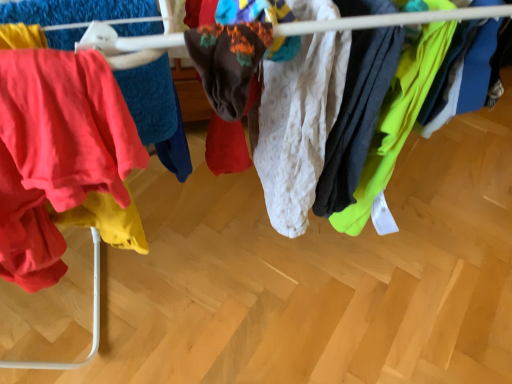
Measure the distance between white textured fabric at center, which appears as the 1th clothing when viewed from the left, and camera.

The depth of white textured fabric at center, which appears as the 1th clothing when viewed from the left, is 14.96 inches.

What do you see at coordinates (298, 126) in the screenshot? This screenshot has width=512, height=384. I see `white textured fabric at center, which appears as the 1th clothing when viewed from the left` at bounding box center [298, 126].

What are the coordinates of `white textured fabric at center, which appears as the 1th clothing when viewed from the left` in the screenshot? It's located at (298, 126).

The width and height of the screenshot is (512, 384). What do you see at coordinates (396, 120) in the screenshot?
I see `white textured fabric at center, positioned as the 1th clothing in right-to-left order` at bounding box center [396, 120].

You are a GUI agent. You are given a task and a screenshot of the screen. Output one action in this format:
    pyautogui.click(x=<x>, y=<y>)
    Task: Click on the white textured fabric at center, positioned as the 1th clothing in right-to-left order
    Image resolution: width=512 pixels, height=384 pixels.
    Given the screenshot: What is the action you would take?
    pyautogui.click(x=396, y=120)

Identify the location of white textured fabric at center, which appears as the second clothing when viewed from the right. (298, 126).

Which object is positioned more to the right, white textured fabric at center, which appears as the 1th clothing when viewed from the left, or white textured fabric at center, positioned as the 1th clothing in right-to-left order?

white textured fabric at center, positioned as the 1th clothing in right-to-left order.

Looking at this image, considering the positions of objects white textured fabric at center, which appears as the 1th clothing when viewed from the left, and white textured fabric at center, positioned as the 1th clothing in right-to-left order, in the image provided, who is behind, white textured fabric at center, which appears as the 1th clothing when viewed from the left, or white textured fabric at center, positioned as the 1th clothing in right-to-left order,?

white textured fabric at center, positioned as the 1th clothing in right-to-left order, is more distant.

Considering the points (266, 181) and (395, 159), which point is behind, point (266, 181) or point (395, 159)?

The point (266, 181) is farther.

From the image's perspective, does white textured fabric at center, which appears as the 1th clothing when viewed from the left, appear lower than white textured fabric at center, the second clothing from the left?

Actually, white textured fabric at center, which appears as the 1th clothing when viewed from the left, appears above white textured fabric at center, the second clothing from the left, in the image.

From a real-world perspective, between white textured fabric at center, which appears as the second clothing when viewed from the right, and white textured fabric at center, positioned as the 1th clothing in right-to-left order, who is vertically higher?

In real-world perspective, white textured fabric at center, positioned as the 1th clothing in right-to-left order, is above.

Considering the relative sizes of white textured fabric at center, which appears as the 1th clothing when viewed from the left, and white textured fabric at center, positioned as the 1th clothing in right-to-left order, in the image provided, is white textured fabric at center, which appears as the 1th clothing when viewed from the left, wider than white textured fabric at center, positioned as the 1th clothing in right-to-left order,?

In fact, white textured fabric at center, which appears as the 1th clothing when viewed from the left, might be narrower than white textured fabric at center, positioned as the 1th clothing in right-to-left order.

From the picture: Is white textured fabric at center, which appears as the second clothing when viewed from the right, taller or shorter than white textured fabric at center, positioned as the 1th clothing in right-to-left order?

In the image, white textured fabric at center, which appears as the second clothing when viewed from the right, appears to be taller than white textured fabric at center, positioned as the 1th clothing in right-to-left order.

Considering the relative sizes of white textured fabric at center, which appears as the second clothing when viewed from the right, and white textured fabric at center, the second clothing from the left, in the image provided, is white textured fabric at center, which appears as the second clothing when viewed from the right, bigger than white textured fabric at center, the second clothing from the left,?

Indeed, white textured fabric at center, which appears as the second clothing when viewed from the right, has a larger size compared to white textured fabric at center, the second clothing from the left.

Is white textured fabric at center, which appears as the 1th clothing when viewed from the left, inside the boundaries of white textured fabric at center, the second clothing from the left, or outside?

white textured fabric at center, which appears as the 1th clothing when viewed from the left, is outside white textured fabric at center, the second clothing from the left.

Is white textured fabric at center, which appears as the 1th clothing when viewed from the left, next to white textured fabric at center, the second clothing from the left?

No.

Looking at this image, is white textured fabric at center, which appears as the second clothing when viewed from the right, oriented towards white textured fabric at center, the second clothing from the left?

Yes, white textured fabric at center, which appears as the second clothing when viewed from the right, is turned towards white textured fabric at center, the second clothing from the left.

How different are the orientations of white textured fabric at center, which appears as the 1th clothing when viewed from the left, and white textured fabric at center, positioned as the 1th clothing in right-to-left order, in degrees?

0.00608 degrees separate the facing orientations of white textured fabric at center, which appears as the 1th clothing when viewed from the left, and white textured fabric at center, positioned as the 1th clothing in right-to-left order.

At what (x,y) coordinates should I click in order to perform the action: click on clothing beneath the white textured fabric at center, the second clothing from the left (from a real-world perspective). Please return your answer as a coordinate pair (x, y). The image size is (512, 384). Looking at the image, I should click on (298, 126).

Between white textured fabric at center, the second clothing from the left, and white textured fabric at center, which appears as the 1th clothing when viewed from the left, which one appears on the right side from the viewer's perspective?

white textured fabric at center, the second clothing from the left, is more to the right.

Which is behind, white textured fabric at center, positioned as the 1th clothing in right-to-left order, or white textured fabric at center, which appears as the second clothing when viewed from the right?

white textured fabric at center, positioned as the 1th clothing in right-to-left order, is further from the camera.

Does point (358, 202) appear closer or farther from the camera than point (328, 39)?

Point (358, 202) is positioned farther from the camera compared to point (328, 39).

From the image's perspective, does white textured fabric at center, the second clothing from the left, appear higher than white textured fabric at center, which appears as the second clothing when viewed from the right?

No, from the image's perspective, white textured fabric at center, the second clothing from the left, is not on top of white textured fabric at center, which appears as the second clothing when viewed from the right.

Looking at this image, from a real-world perspective, which object rests below the other?

In real-world perspective, white textured fabric at center, which appears as the 1th clothing when viewed from the left, is lower.

Based on the photo, considering the sizes of objects white textured fabric at center, the second clothing from the left, and white textured fabric at center, which appears as the 1th clothing when viewed from the left, in the image provided, who is wider, white textured fabric at center, the second clothing from the left, or white textured fabric at center, which appears as the 1th clothing when viewed from the left,?

Wider between the two is white textured fabric at center, the second clothing from the left.

In the scene shown: Can you confirm if white textured fabric at center, positioned as the 1th clothing in right-to-left order, is shorter than white textured fabric at center, which appears as the 1th clothing when viewed from the left?

Correct, white textured fabric at center, positioned as the 1th clothing in right-to-left order, is not as tall as white textured fabric at center, which appears as the 1th clothing when viewed from the left.

Looking at the image, does white textured fabric at center, positioned as the 1th clothing in right-to-left order, seem bigger or smaller compared to white textured fabric at center, which appears as the 1th clothing when viewed from the left?

white textured fabric at center, positioned as the 1th clothing in right-to-left order, is smaller than white textured fabric at center, which appears as the 1th clothing when viewed from the left.

Is white textured fabric at center, the second clothing from the left, inside the boundaries of white textured fabric at center, which appears as the 1th clothing when viewed from the left, or outside?

white textured fabric at center, the second clothing from the left, exists outside the volume of white textured fabric at center, which appears as the 1th clothing when viewed from the left.

Consider the image. Are white textured fabric at center, positioned as the 1th clothing in right-to-left order, and white textured fabric at center, which appears as the second clothing when viewed from the right, located far from each other?

No, white textured fabric at center, positioned as the 1th clothing in right-to-left order, is in close proximity to white textured fabric at center, which appears as the second clothing when viewed from the right.

Does white textured fabric at center, the second clothing from the left, turn towards white textured fabric at center, which appears as the second clothing when viewed from the right?

Yes, white textured fabric at center, the second clothing from the left, is facing white textured fabric at center, which appears as the second clothing when viewed from the right.

Measure the distance from white textured fabric at center, positioned as the 1th clothing in right-to-left order, to white textured fabric at center, which appears as the 1th clothing when viewed from the left.

They are 4.15 inches apart.

Find the location of a particular element. The height and width of the screenshot is (384, 512). clothing on the left of white textured fabric at center, positioned as the 1th clothing in right-to-left order is located at coordinates (298, 126).

Find the location of a particular element. Image resolution: width=512 pixels, height=384 pixels. clothing that is on the right side of white textured fabric at center, which appears as the second clothing when viewed from the right is located at coordinates (396, 120).

Locate an element on the screen. clothing above the white textured fabric at center, the second clothing from the left (from the image's perspective) is located at coordinates (298, 126).